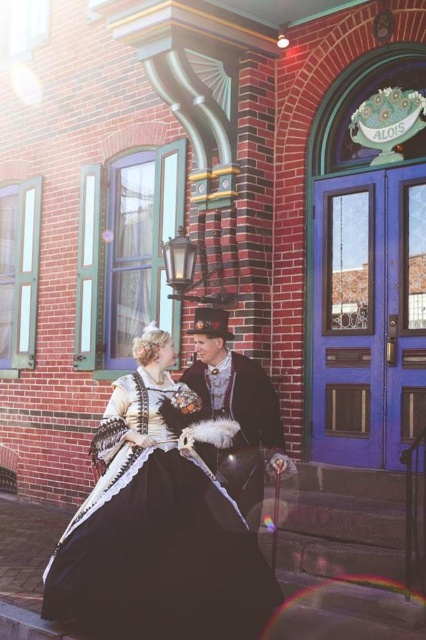
Can you confirm if black satin dress at center is positioned to the right of velvet black coat at center?

No, black satin dress at center is not to the right of velvet black coat at center.

Is black satin dress at center above velvet black coat at center?

No, black satin dress at center is not above velvet black coat at center.

Image resolution: width=426 pixels, height=640 pixels. I want to click on black satin dress at center, so click(x=157, y=536).

You are a GUI agent. You are given a task and a screenshot of the screen. Output one action in this format:
    pyautogui.click(x=<x>, y=<y>)
    Task: Click on the black satin dress at center
    This screenshot has width=426, height=640.
    Given the screenshot: What is the action you would take?
    pyautogui.click(x=157, y=536)